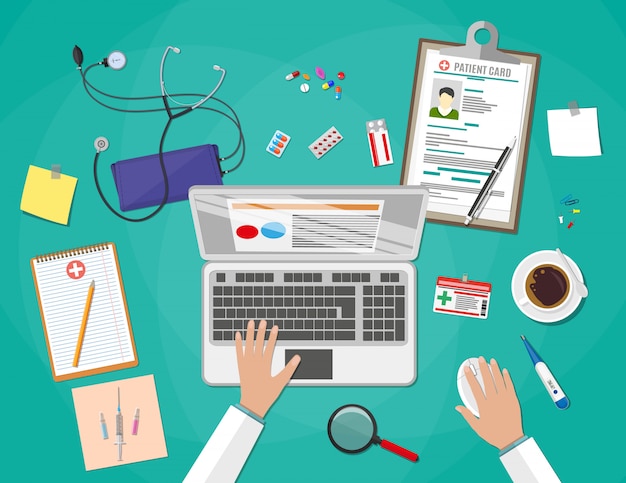
Locate an element on the screen. papers is located at coordinates (103, 325), (108, 398), (499, 82), (530, 70), (572, 131), (44, 198).